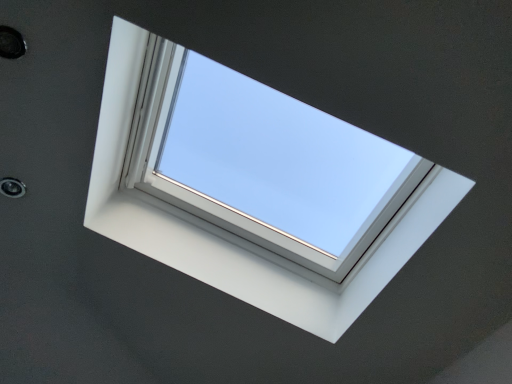
Question: Is metallic circular hole at upper left, which is counted as the second hole, starting from the back, closer to the viewer compared to white plastic window at center?

Choices:
 (A) no
 (B) yes

Answer: (A)

Question: From the image's perspective, is metallic circular hole at upper left, which is the second hole from left to right, located beneath white plastic window at center?

Choices:
 (A) no
 (B) yes

Answer: (A)

Question: Is metallic circular hole at upper left, which is the first hole in top-to-bottom order, positioned with its back to white plastic window at center?

Choices:
 (A) no
 (B) yes

Answer: (A)

Question: Is metallic circular hole at upper left, which is the first hole in top-to-bottom order, surrounding white plastic window at center?

Choices:
 (A) yes
 (B) no

Answer: (B)

Question: From a real-world perspective, is metallic circular hole at upper left, arranged as the first hole when viewed from the front, on top of white plastic window at center?

Choices:
 (A) yes
 (B) no

Answer: (B)

Question: Is metallic circular hole at upper left, which is the first hole from right to left, smaller than white plastic window at center?

Choices:
 (A) no
 (B) yes

Answer: (B)

Question: Can you confirm if metallic circular hole at upper left, which is the 1th hole from bottom to top, is taller than metallic circular hole at upper left, acting as the second hole starting from the bottom?

Choices:
 (A) no
 (B) yes

Answer: (A)

Question: Does metallic circular hole at upper left, which is the second hole in right-to-left order, appear on the left side of metallic circular hole at upper left, acting as the second hole starting from the bottom?

Choices:
 (A) yes
 (B) no

Answer: (A)

Question: From the image's perspective, is metallic circular hole at upper left, positioned as the 1th hole in left-to-right order, above metallic circular hole at upper left, which is counted as the second hole, starting from the back?

Choices:
 (A) yes
 (B) no

Answer: (B)

Question: From a real-world perspective, does metallic circular hole at upper left, positioned as the 1th hole in left-to-right order, sit lower than metallic circular hole at upper left, which is the second hole from left to right?

Choices:
 (A) yes
 (B) no

Answer: (A)

Question: Is metallic circular hole at upper left, positioned as the 1th hole in left-to-right order, positioned with its back to metallic circular hole at upper left, arranged as the first hole when viewed from the front?

Choices:
 (A) no
 (B) yes

Answer: (A)

Question: Is metallic circular hole at upper left, positioned as the 1th hole in left-to-right order, not near metallic circular hole at upper left, which is counted as the second hole, starting from the back?

Choices:
 (A) no
 (B) yes

Answer: (A)

Question: From the image's perspective, is white plastic window at center over metallic circular hole at upper left, which is the 1th hole from bottom to top?

Choices:
 (A) no
 (B) yes

Answer: (B)